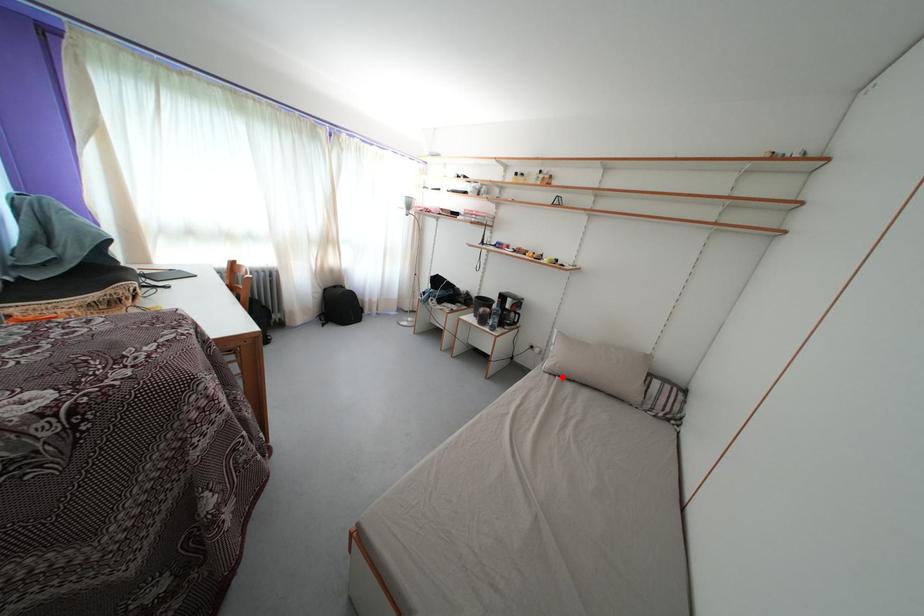
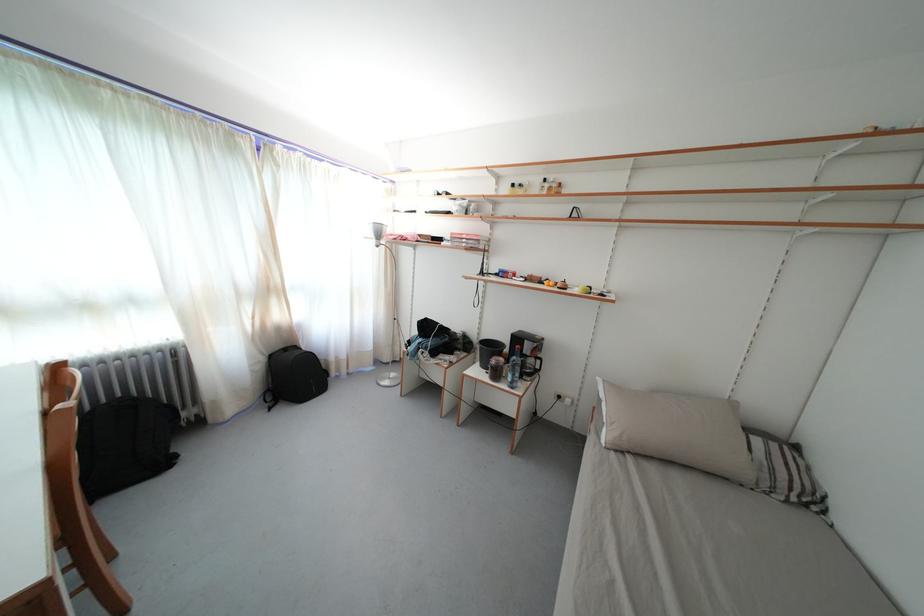
Find the pixel in the second image that matches the highlighted location in the first image.

(630, 452)